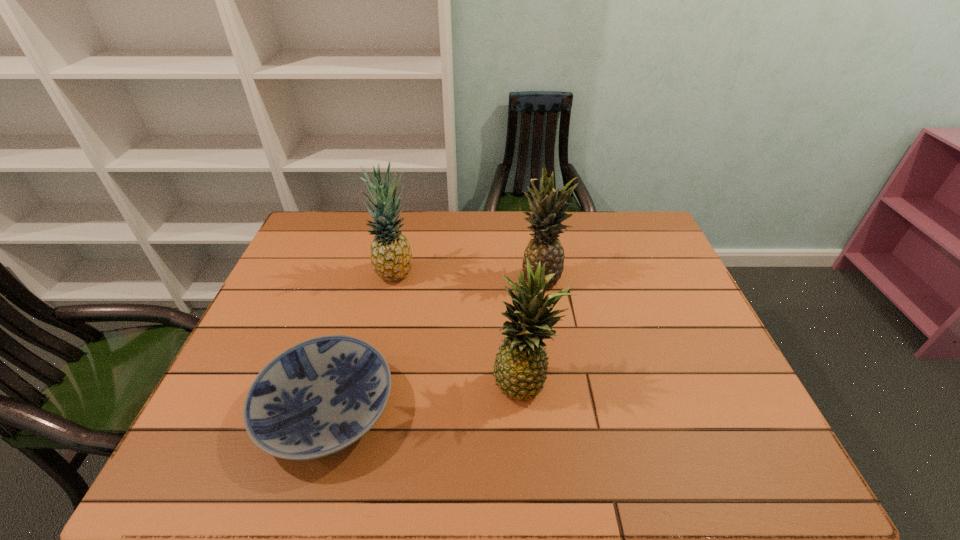
Where is `free space at the near edge`? free space at the near edge is located at coordinates (428, 465).

Where is `vacant position at the left edge of the desktop`? The image size is (960, 540). vacant position at the left edge of the desktop is located at coordinates (300, 336).

Identify the location of vacant space at the right edge of the desktop. [x=634, y=258].

In the image, there is a desktop. At what (x,y) coordinates should I click in order to perform the action: click on free space at the far left corner. Please return your answer as a coordinate pair (x, y). The width and height of the screenshot is (960, 540). Looking at the image, I should click on (324, 228).

Locate an element on the screen. The image size is (960, 540). vacant region between the leftmost pineapple and the nearest pineapple is located at coordinates (461, 327).

Locate an element on the screen. unoccupied area between the nearest pineapple and the leftmost pineapple is located at coordinates (461, 327).

Choose which object is the nearest neighbor to the shortest object. Please provide its 2D coordinates. Your answer should be formatted as a tuple, i.e. [(x, y)], where the tuple contains the x and y coordinates of a point satisfying the conditions above.

[(520, 368)]

Where is `object that can be found as the third closest to the leftmost pineapple`? object that can be found as the third closest to the leftmost pineapple is located at coordinates (520, 368).

Select which pineapple is the second closest to the nearest pineapple. Please provide its 2D coordinates. Your answer should be formatted as a tuple, i.e. [(x, y)], where the tuple contains the x and y coordinates of a point satisfying the conditions above.

[(391, 257)]

Identify which pineapple is the closest to the plate. Please provide its 2D coordinates. Your answer should be formatted as a tuple, i.e. [(x, y)], where the tuple contains the x and y coordinates of a point satisfying the conditions above.

[(520, 368)]